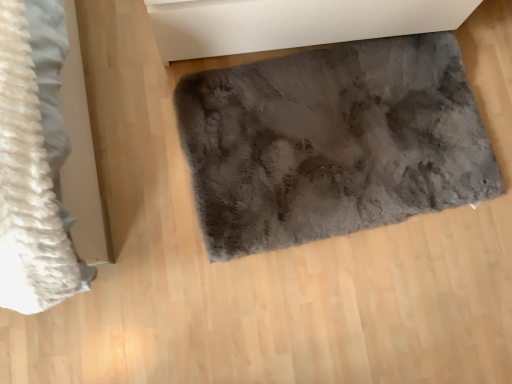
What do you see at coordinates (331, 142) in the screenshot?
I see `fuzzy gray mat at center` at bounding box center [331, 142].

Identify the location of fuzzy gray mat at center. The height and width of the screenshot is (384, 512). (331, 142).

This screenshot has width=512, height=384. Identify the location of fuzzy gray mat at center. (331, 142).